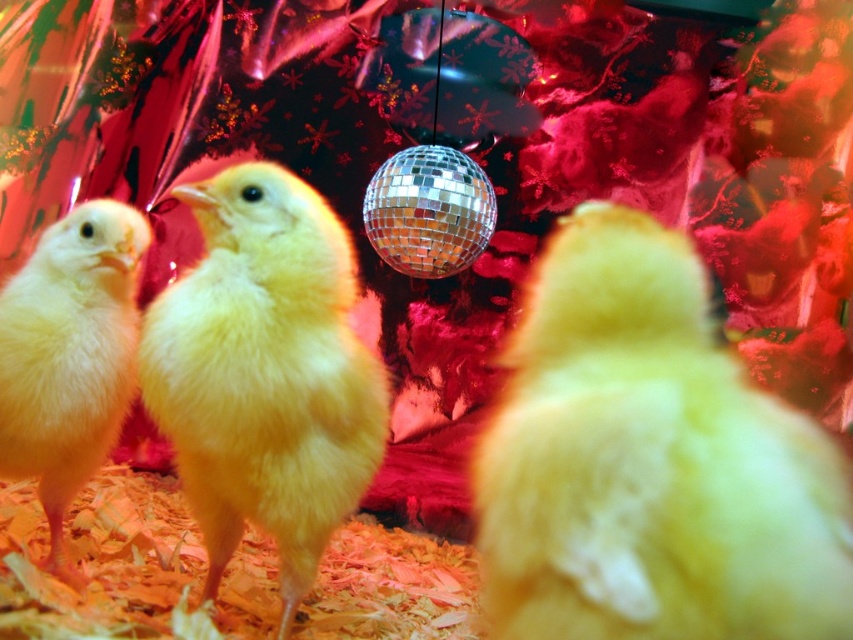
Question: Does yellow fluffy chick at center come behind yellow fluffy chicken at center?

Choices:
 (A) yes
 (B) no

Answer: (B)

Question: Considering the real-world distances, which object is farthest from the shiny metallic disco ball at center?

Choices:
 (A) yellow fluffy chick at center
 (B) yellow fluffy chick at left

Answer: (A)

Question: Does yellow fluffy chick at center have a smaller size compared to yellow fluffy chick at left?

Choices:
 (A) yes
 (B) no

Answer: (B)

Question: Can you confirm if yellow fluffy chick at center is smaller than yellow fluffy chicken at center?

Choices:
 (A) no
 (B) yes

Answer: (B)

Question: Among these objects, which one is nearest to the camera?

Choices:
 (A) yellow fluffy chicken at center
 (B) shiny metallic disco ball at center
 (C) yellow fluffy chick at left

Answer: (A)

Question: Estimate the real-world distances between objects in this image. Which object is closer to the yellow fluffy chick at left?

Choices:
 (A) yellow fluffy chick at center
 (B) shiny metallic disco ball at center
 (C) yellow fluffy chicken at center

Answer: (C)